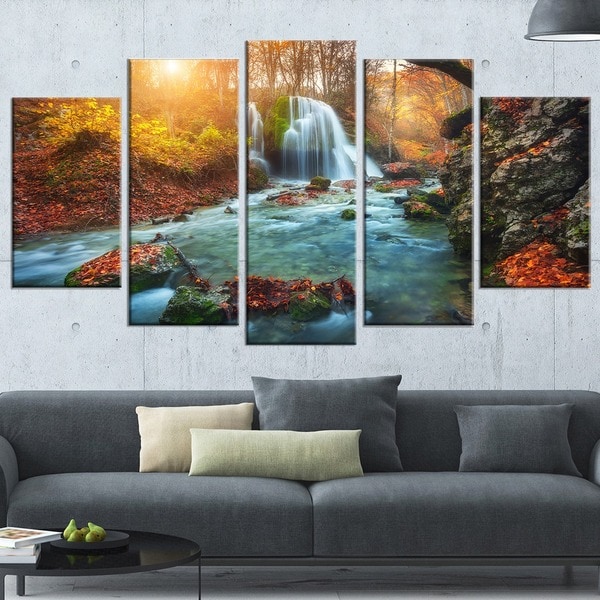
Where is `pillows`? The image size is (600, 600). pillows is located at coordinates (171, 430), (275, 453), (301, 419), (518, 444).